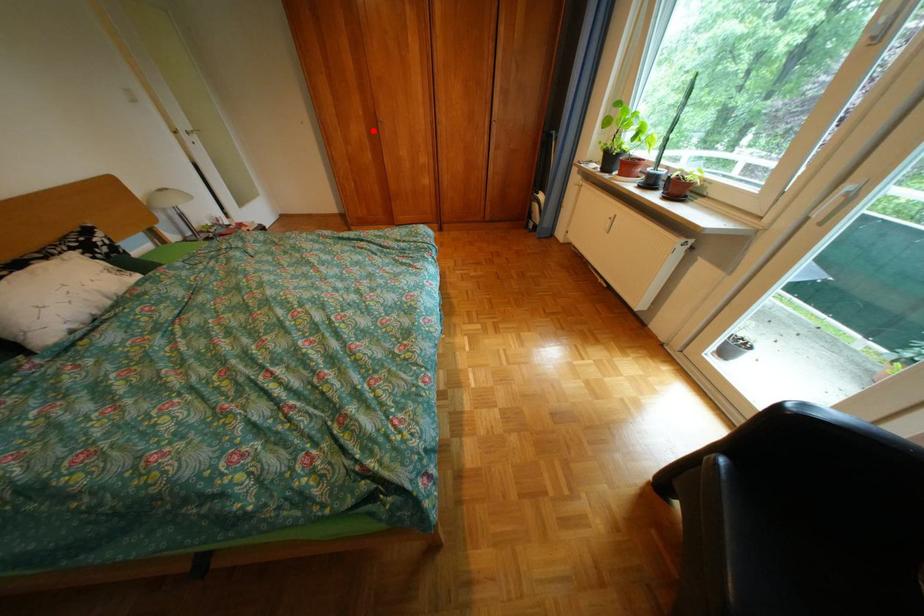
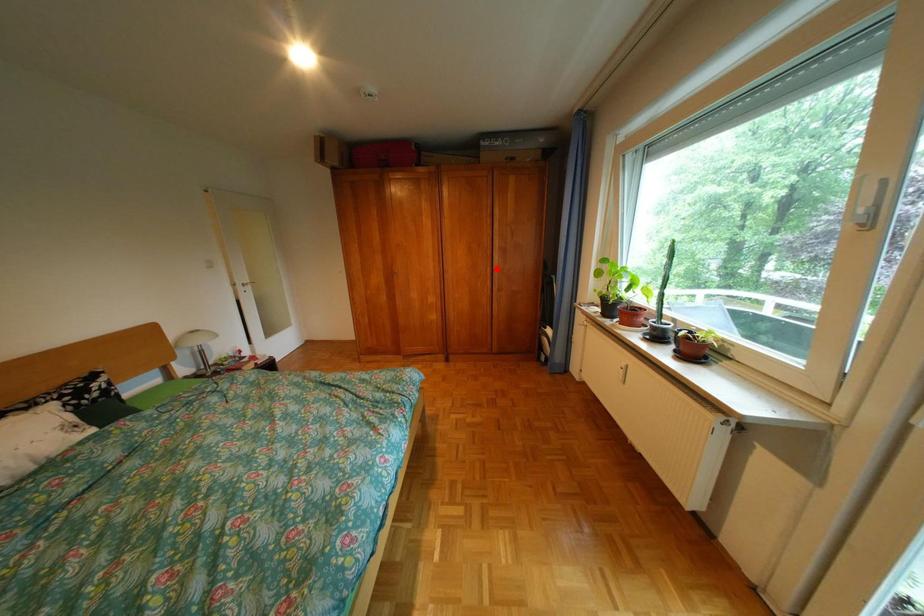
I am providing you with two images of the same scene from different viewpoints. A red point is marked on the first image and another point is marked on the second image. Are the points marked in image1 and image2 representing the same 3D position?

No